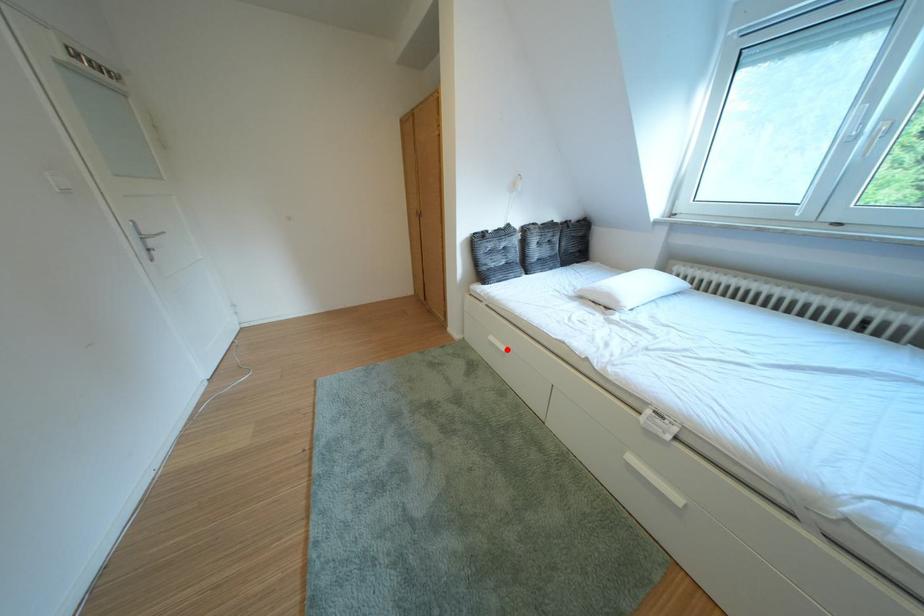
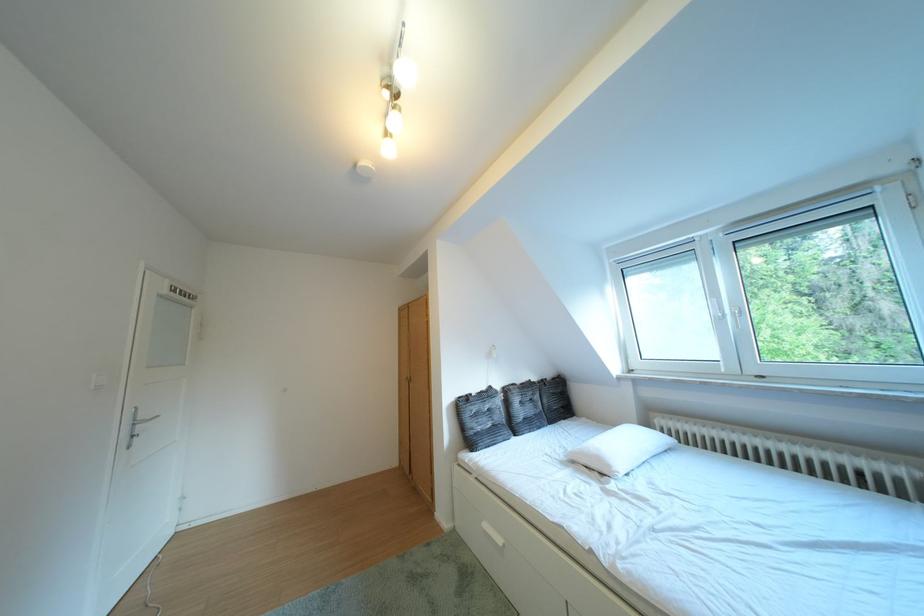
Question: I am providing you with two images of the same scene from different viewpoints. Given a red point in image1, look at the same physical point in image2. Is it:

Choices:
 (A) Closer to the viewpoint
 (B) Farther from the viewpoint

Answer: (B)